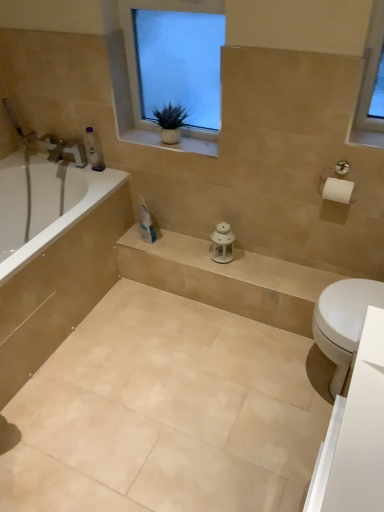
Question: Based on their sizes in the image, would you say white textured window at upper center is bigger or smaller than green matte plant at upper center?

Choices:
 (A) small
 (B) big

Answer: (B)

Question: Looking at their shapes, would you say white textured window at upper center is wider or thinner than green matte plant at upper center?

Choices:
 (A) wide
 (B) thin

Answer: (B)

Question: Which object is the closest to the green matte plant at upper center?

Choices:
 (A) beige ceramic tile at lower center
 (B) beige stone balustrade at center
 (C) white textured window at upper center
 (D) white glossy bathtub at left
 (E) translucent plastic bottle at upper left

Answer: (C)

Question: Which is farther from the translucent plastic bottle at upper left?

Choices:
 (A) green matte plant at upper center
 (B) beige stone balustrade at center
 (C) white textured window at upper center
 (D) beige ceramic tile at lower center
 (E) white glossy bathtub at left

Answer: (D)